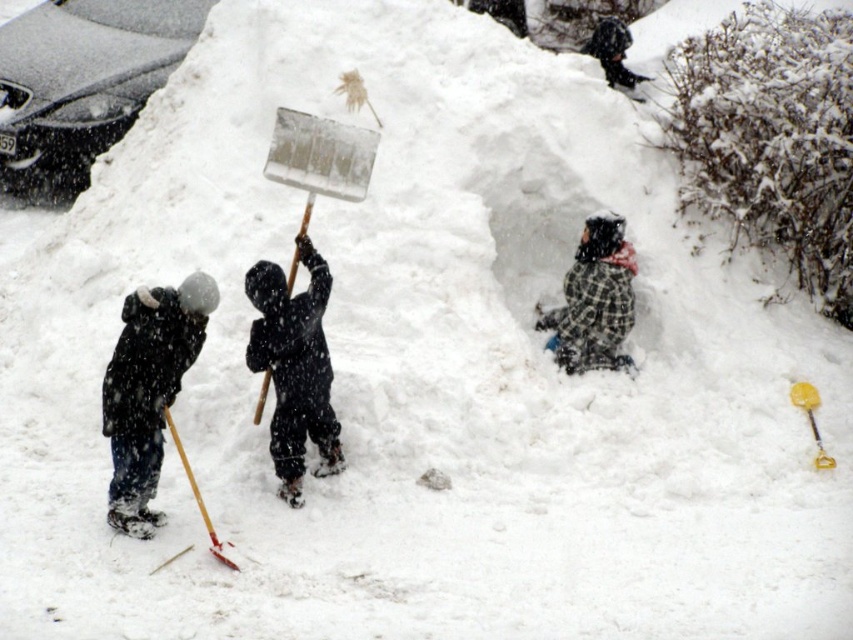
Question: In this image, where is plaid fabric at center located relative to wooden shovel at lower left?

Choices:
 (A) right
 (B) left

Answer: (A)

Question: Among these points, which one is farthest from the camera?

Choices:
 (A) (612, 81)
 (B) (219, 550)

Answer: (A)

Question: Does plaid fabric at center appear under wooden shovel at lower left?

Choices:
 (A) yes
 (B) no

Answer: (B)

Question: Estimate the real-world distances between objects in this image. Which object is closer to the plaid fabric at center?

Choices:
 (A) dark gray hooded jacket at upper center
 (B) black matte snow shovel at center
 (C) wooden shovel at lower left

Answer: (A)

Question: Is plaid fabric at center further to the viewer compared to wooden shovel at lower left?

Choices:
 (A) no
 (B) yes

Answer: (B)

Question: Which point is farther to the camera?

Choices:
 (A) black matte snowsuit at left
 (B) wooden shovel at lower left

Answer: (B)